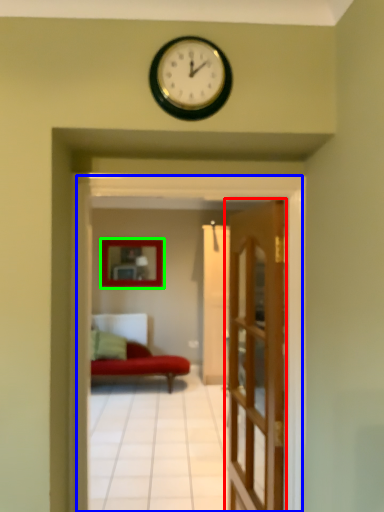
Question: Which is nearer to the door (highlighted by a red box)? residence (highlighted by a blue box) or picture frame (highlighted by a green box).

Choices:
 (A) residence
 (B) picture frame

Answer: (A)